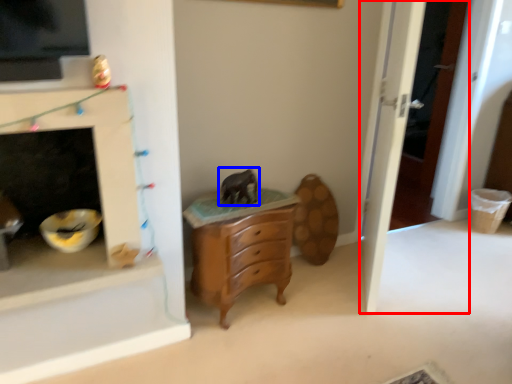
Question: Among these objects, which one is farthest to the camera, door (highlighted by a red box) or animal (highlighted by a blue box)?

Choices:
 (A) door
 (B) animal

Answer: (B)